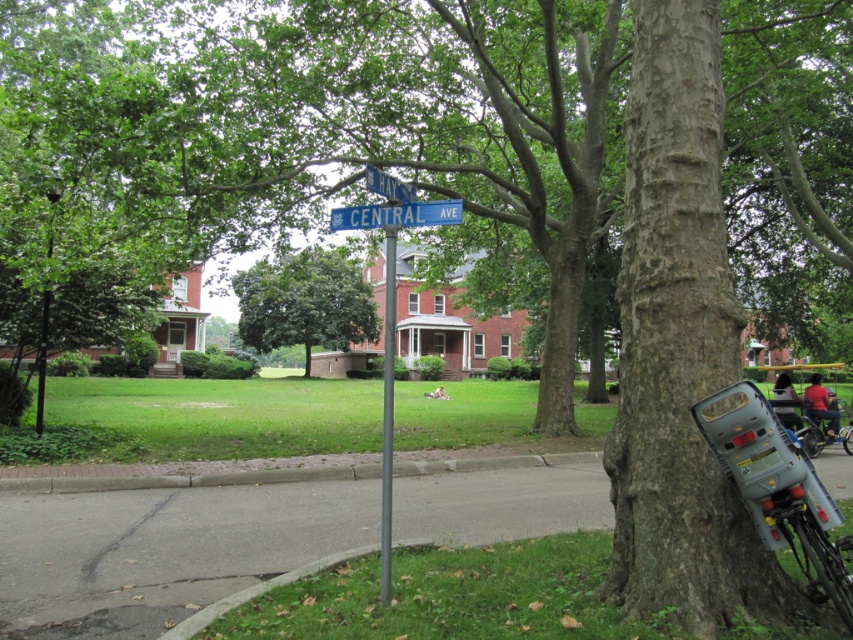
Looking at this image, does blue metallic street sign at center lie in front of black metal pole at upper left?

That is True.

Looking at this image, which of these two, blue metallic street sign at center or black metal pole at upper left, stands shorter?

With less height is blue metallic street sign at center.

Where is `blue metallic street sign at center`? blue metallic street sign at center is located at coordinates (396, 214).

Looking at this image, between metallic gray bicycle at tree right and metallic pole at center, which one has less height?

metallic gray bicycle at tree right is shorter.

Is metallic gray bicycle at tree right positioned in front of metallic pole at center?

Yes, it is in front of metallic pole at center.

Locate an element on the screen. metallic gray bicycle at tree right is located at coordinates (778, 490).

Which is in front, point (844, 404) or point (410, 189)?

Point (410, 189) is in front.

Based on the photo, is metallic silver bicycle at lower right positioned in front of blue plastic street sign at upper center?

No, it is not.

Identify the location of metallic silver bicycle at lower right. (822, 433).